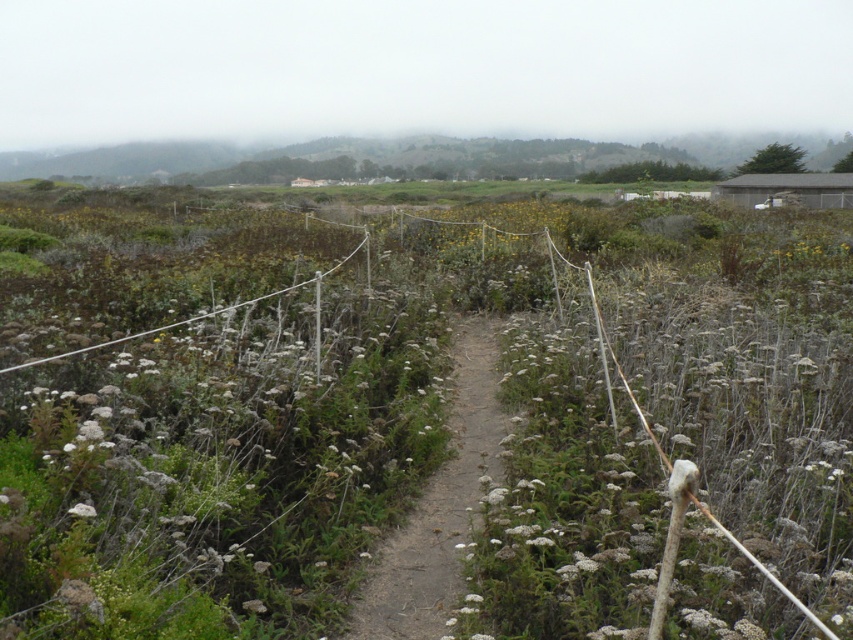
Is green matte plant at center bigger than dirt path at center?

Yes.

Which of these two, green matte plant at center or dirt path at center, stands shorter?

With less height is dirt path at center.

Describe the element at coordinates (300, 435) in the screenshot. I see `green matte plant at center` at that location.

Where is `green matte plant at center`? Image resolution: width=853 pixels, height=640 pixels. green matte plant at center is located at coordinates (300, 435).

Does green matte plant at center appear on the left side of white fluffy flower at center?

In fact, green matte plant at center is to the right of white fluffy flower at center.

Who is more distant from viewer, (548, 362) or (77, 513)?

Point (548, 362)

The image size is (853, 640). Identify the location of green matte plant at center. (300, 435).

Can you confirm if dirt path at center is taller than white fluffy flower at center?

Indeed, dirt path at center has a greater height compared to white fluffy flower at center.

Consider the image. Is dirt path at center to the right of white fluffy flower at center from the viewer's perspective?

Yes, dirt path at center is to the right of white fluffy flower at center.

The height and width of the screenshot is (640, 853). I want to click on dirt path at center, so click(x=439, y=506).